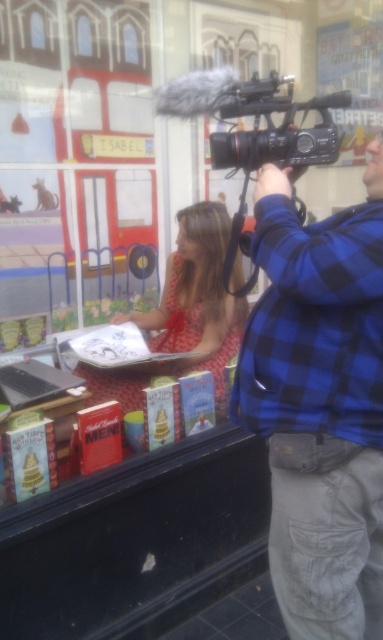
Question: Is blue plaid shirt at upper right to the left of blue checkered shirt at upper right from the viewer's perspective?

Choices:
 (A) no
 (B) yes

Answer: (A)

Question: Considering the relative positions of blue checkered shirt at upper right and black plastic video camera at upper center in the image provided, where is blue checkered shirt at upper right located with respect to black plastic video camera at upper center?

Choices:
 (A) above
 (B) below

Answer: (B)

Question: Estimate the real-world distances between objects in this image. Which object is farther from the matte red dress at center?

Choices:
 (A) blue checkered shirt at upper right
 (B) blue plaid shirt at upper right

Answer: (A)

Question: Does matte red dress at center come behind silver metallic laptop at lower left?

Choices:
 (A) yes
 (B) no

Answer: (A)

Question: Among these points, which one is nearest to the camera?

Choices:
 (A) (296, 416)
 (B) (194, 330)
 (C) (345, 360)

Answer: (C)

Question: Which point is closer to the camera?

Choices:
 (A) (343, 225)
 (B) (234, 305)
 (C) (18, 396)
 (D) (346, 90)

Answer: (A)